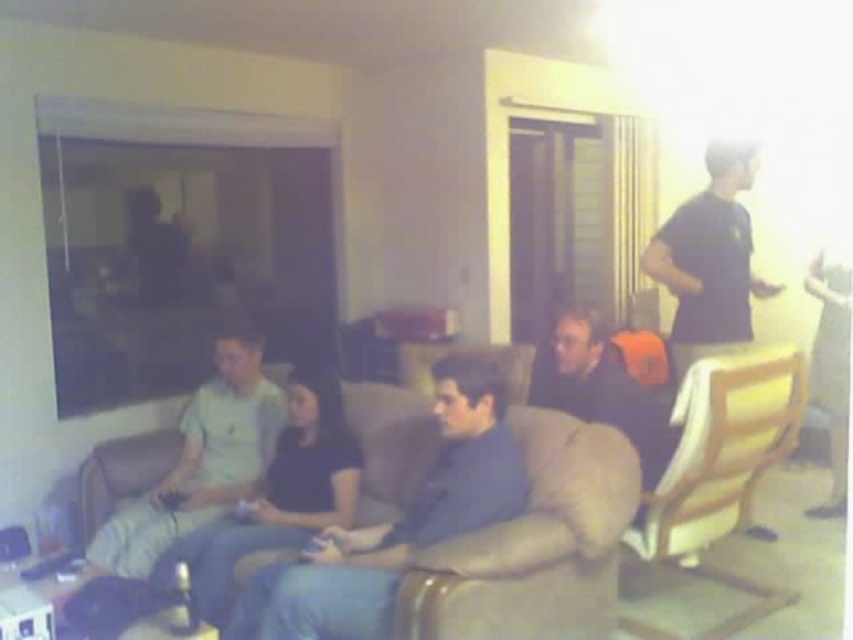
You are planning to host a small gathering and need to know if the blue fabric couch at center can accommodate an additional guest. Considering the size of the dark blue shirt at center, which is worn by a person sitting on the couch, do you think there is enough space?

The blue fabric couch at center has a larger size compared to the dark blue shirt at center. Since the couch is bigger, there might be enough space to accommodate an additional guest, but it depends on how much space the person wearing the dark blue shirt is already occupying.

You are standing in the living room and need to find the light green fabric shirt at left. According to the scene description, where exactly is it positioned?

The light green fabric shirt at left is located at point (202, 458) in the image coordinates.